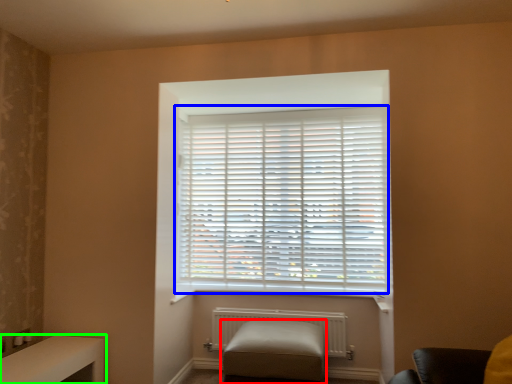
Question: Based on their relative distances, which object is nearer to furniture (highlighted by a red box)? Choose from window blind (highlighted by a blue box) and table (highlighted by a green box).

Choices:
 (A) window blind
 (B) table

Answer: (A)